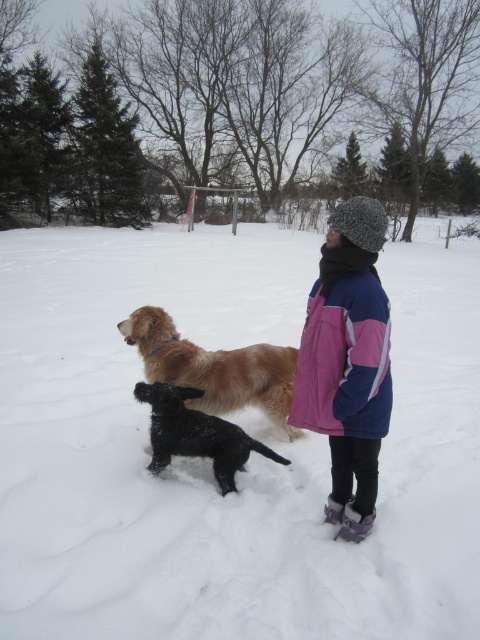
Can you confirm if golden fur dog at center is positioned below shiny black dog at center?

Incorrect, golden fur dog at center is not positioned below shiny black dog at center.

Can you confirm if golden fur dog at center is positioned to the left of shiny black dog at center?

No, golden fur dog at center is not to the left of shiny black dog at center.

Which is in front, point (282, 364) or point (207, 424)?

Positioned in front is point (207, 424).

Locate an element on the screen. The image size is (480, 640). golden fur dog at center is located at coordinates (215, 369).

This screenshot has height=640, width=480. What do you see at coordinates (206, 461) in the screenshot?
I see `white fluffy snow at center` at bounding box center [206, 461].

Is white fluffy snow at center positioned before golden fur dog at center?

Yes, it is in front of golden fur dog at center.

Between point (60, 387) and point (226, 401), which one is positioned behind?

Positioned behind is point (60, 387).

Find the location of `white fluffy snow at center`. white fluffy snow at center is located at coordinates (206, 461).

Does point (361, 442) come in front of point (165, 394)?

Yes, point (361, 442) is closer to viewer.

Between point (380, 237) and point (244, 448), which one is positioned behind?

Positioned behind is point (244, 448).

Is point (354, 264) closer to viewer compared to point (153, 384)?

Yes, it is.

Image resolution: width=480 pixels, height=640 pixels. What are the coordinates of `pink fleece jacket at center` in the screenshot? It's located at (348, 362).